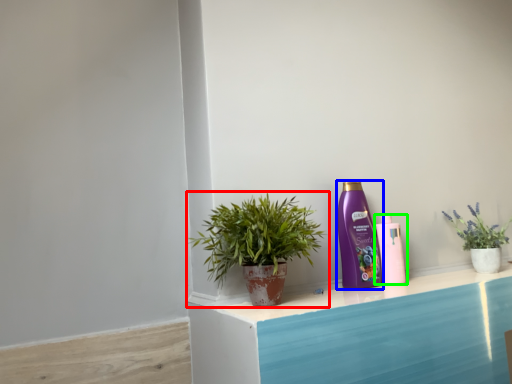
Question: Based on their relative distances, which object is farther from houseplant (highlighted by a red box)? Choose from bottle (highlighted by a blue box) and bottle (highlighted by a green box).

Choices:
 (A) bottle
 (B) bottle

Answer: (B)